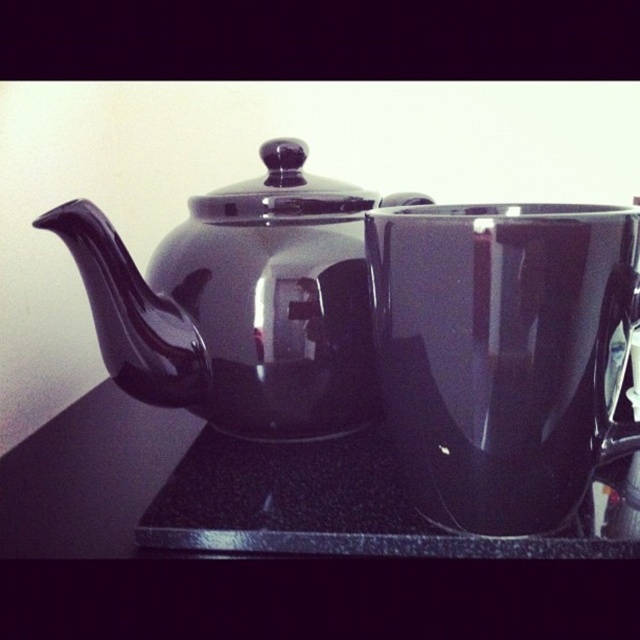
You are a delivery person who needs to place a new teacup that is 10 cm tall on the glossy black countertop at center. The current items on the countertop include the glossy ceramic teapot at center. Can the teapot be moved to make space for the new teacup?

The glossy ceramic teapot at center is much taller than the glossy black countertop at center, so the teapot cannot be moved because it is taller than the countertop and might not fit back properly.

You are setting up a table for a tea ceremony and need to ensure the glossy ceramic teapot at center fits on the glossy black countertop at center. Based on their sizes, will the teapot fit without overhanging the edges?

The glossy ceramic teapot at center is larger in size than the glossy black countertop at center, so it will overhang the edges and not fit properly.

You are arranging a display and need to place the glossy ceramic teapot at center on top of the glossy black countertop at center. Will the teapot fit horizontally on the countertop without overhanging the edges?

The glossy ceramic teapot at center is thinner than the glossy black countertop at center, so it should fit horizontally without overhanging the edges.